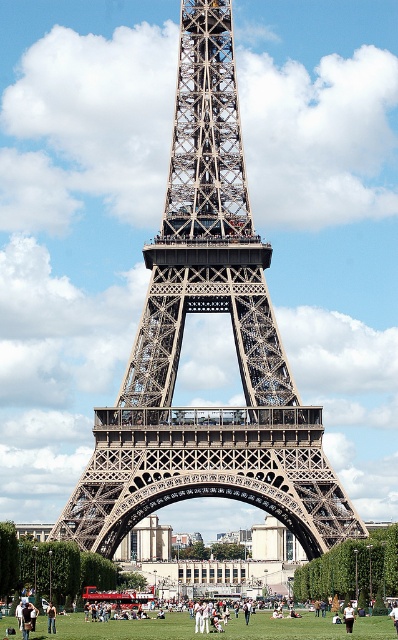
You are standing at the base of the Eiffel Tower and notice two points marked on the tower. One is at coordinates point (314,516) and the other at point (353,621). Which of these points is closer to you?

Point (353,621) is closer to you because it is in front of point (314,516).

You are standing in front of the Eiffel Tower and see a person wearing a white cotton shirt at center and skinny jeans at center. From your perspective, which clothing item is positioned to the right?

The white cotton shirt at center is to the right of the skinny jeans at center.